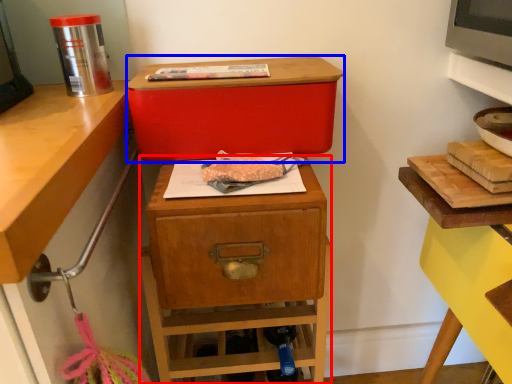
Question: Which of the following is the farthest to the observer, nightstand (highlighted by a red box) or storage box (highlighted by a blue box)?

Choices:
 (A) nightstand
 (B) storage box

Answer: (A)